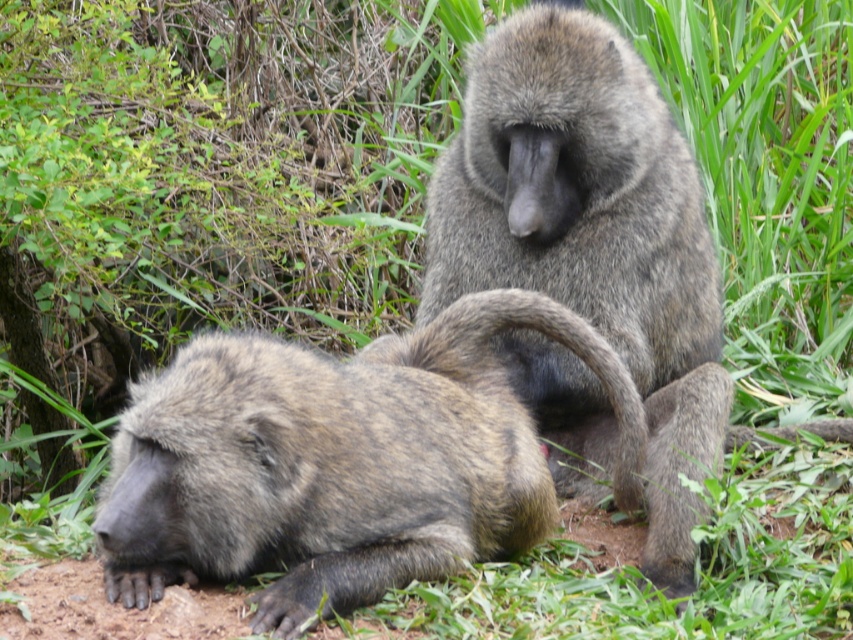
Between brown fur monkey at lower left and gray furry monkey at center, which one has more height?

Standing taller between the two is gray furry monkey at center.

Which is more to the left, brown fur monkey at lower left or gray furry monkey at center?

brown fur monkey at lower left is more to the left.

Does point (560, 333) lie behind point (486, 227)?

No, it is in front of (486, 227).

Locate an element on the screen. brown fur monkey at lower left is located at coordinates (341, 461).